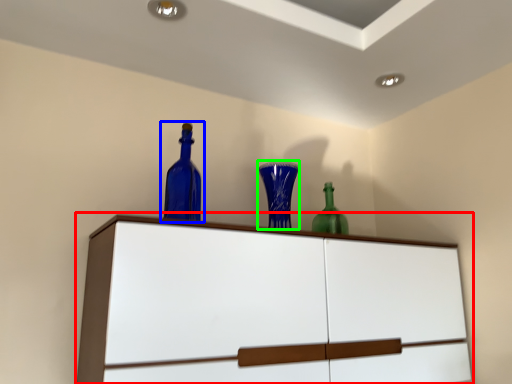
Question: Which object is positioned closest to cupboard (highlighted by a red box)? Select from bottle (highlighted by a blue box) and glass vase (highlighted by a green box).

Choices:
 (A) bottle
 (B) glass vase

Answer: (B)